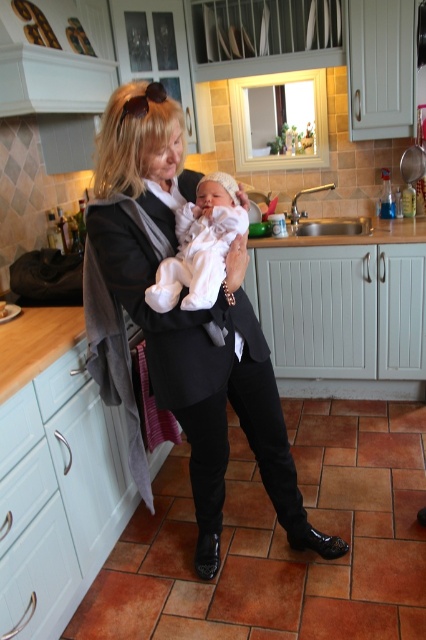
You are a fashion designer observing the image. You need to determine which item is larger between the black smooth business suit at center and the white soft fabric newborn at center. Which one is bigger?

The black smooth business suit at center is bigger than the white soft fabric newborn at center.

You are a fashion designer observing the kitchen scene and need to measure the distance between the black smooth business suit at center and the nearest kitchen appliance. Can you determine if the distance is more than 1 meter?

The black smooth business suit at center is 1.35 meters away from the viewer, so the distance to the nearest kitchen appliance would depend on the appliance location. However, since the question only provides the distance from the viewer, we cannot accurately determine the distance to the appliance without additional information.